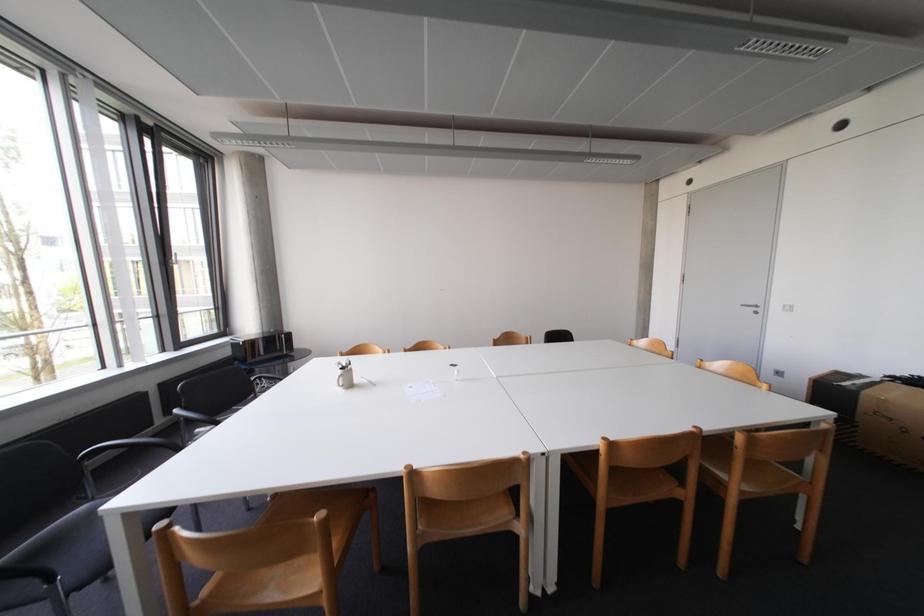
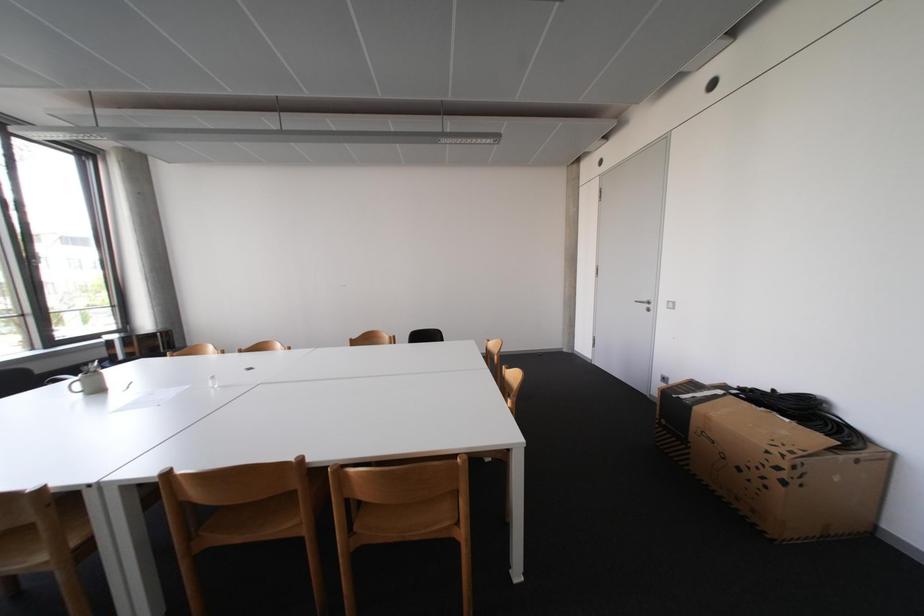
Question: What movement of the cameraman would produce the second image?

Choices:
 (A) Left
 (B) Right
 (C) Forward
 (D) Backward

Answer: (B)